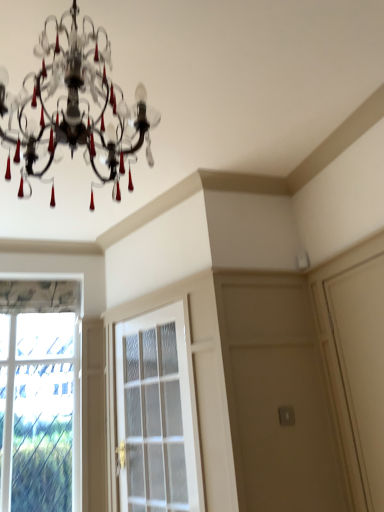
Question: In the image, is matte black chandelier at upper center on the left side or the right side of clear glass window at left?

Choices:
 (A) right
 (B) left

Answer: (A)

Question: Considering the positions of matte black chandelier at upper center and clear glass window at left in the image, is matte black chandelier at upper center taller or shorter than clear glass window at left?

Choices:
 (A) tall
 (B) short

Answer: (B)

Question: Estimate the real-world distances between objects in this image. Which object is farther from the clear glass window at left?

Choices:
 (A) matte black chandelier at upper center
 (B) white glass screen door at center

Answer: (A)

Question: Which of these objects is positioned farthest from the clear glass window at left?

Choices:
 (A) matte black chandelier at upper center
 (B) white glass screen door at center

Answer: (A)